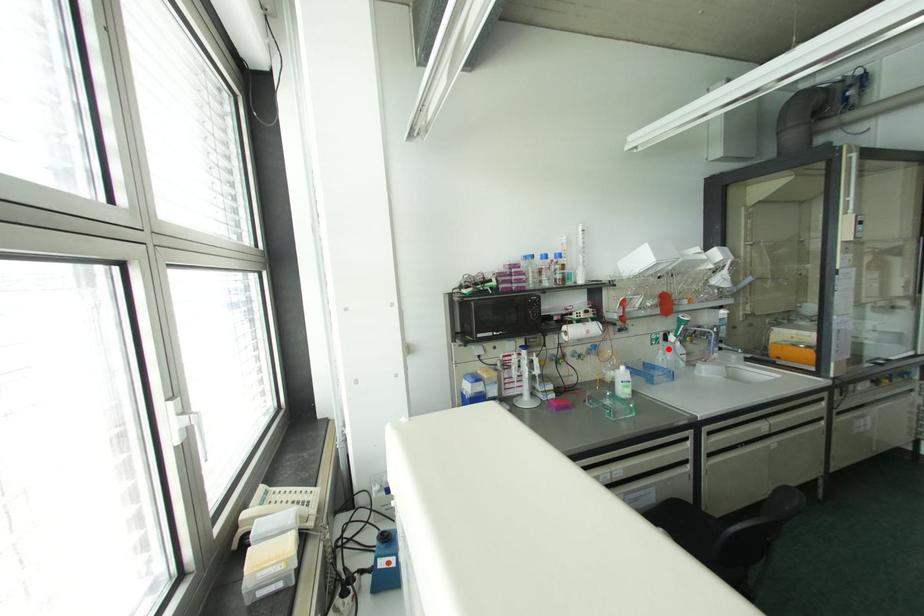
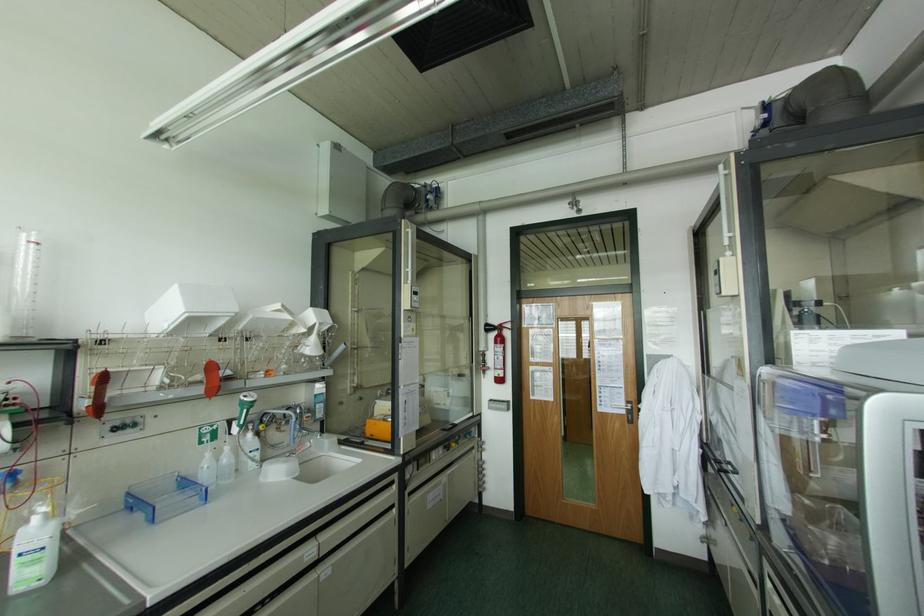
Where in the second image is the point corresponding to the highlighted location from the first image?

(226, 448)